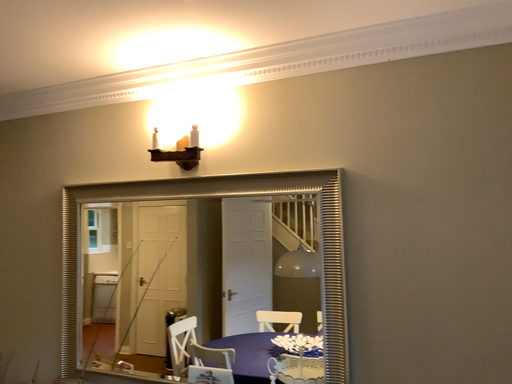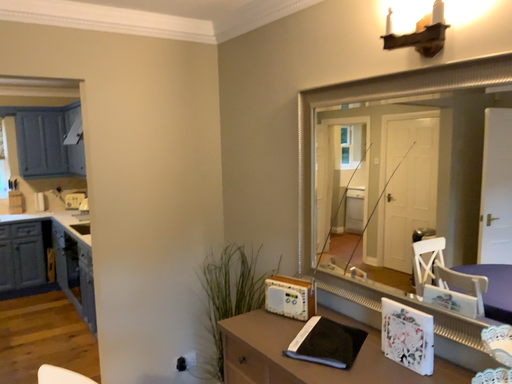
Question: How did the camera likely rotate when shooting the video?

Choices:
 (A) rotated downward
 (B) rotated upward

Answer: (A)